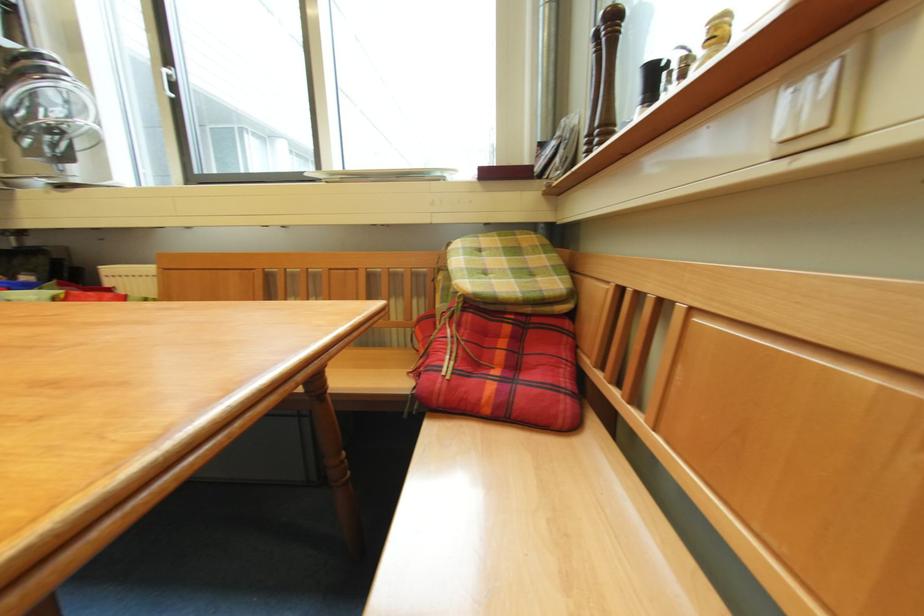
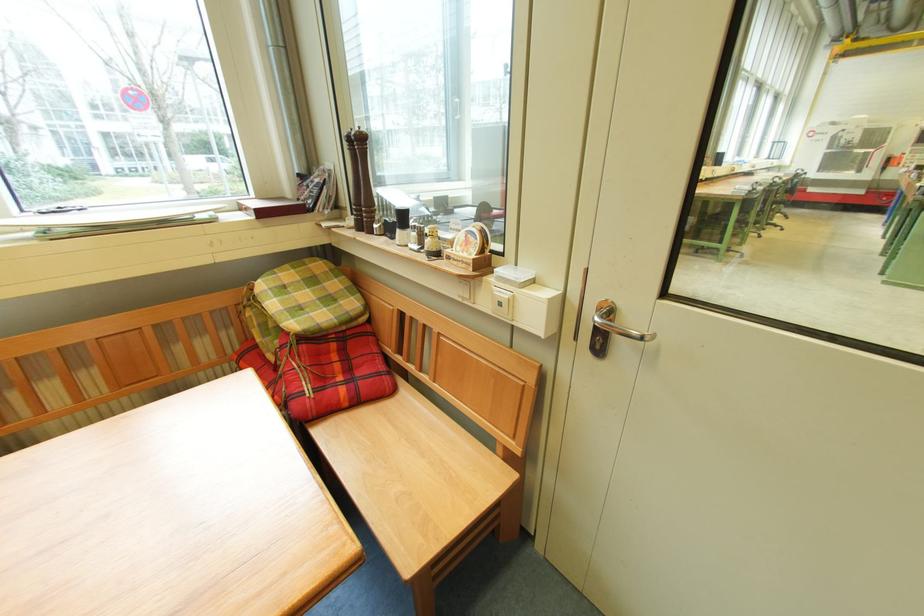
Find the pixel in the second image that matches (502,237) in the first image.

(295, 268)